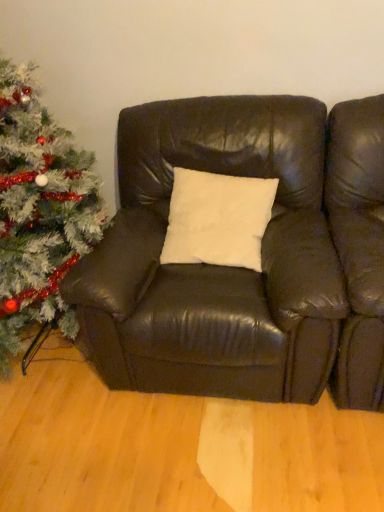
Question: Is point (182, 382) positioned closer to the camera than point (54, 321)?

Choices:
 (A) farther
 (B) closer

Answer: (B)

Question: Considering their positions, is matte brown leather couch at center located in front of or behind white glittery christmas tree at left?

Choices:
 (A) front
 (B) behind

Answer: (B)

Question: In the image, is matte brown leather couch at center on the left side or the right side of white glittery christmas tree at left?

Choices:
 (A) left
 (B) right

Answer: (B)

Question: Does point (8, 308) appear closer or farther from the camera than point (221, 126)?

Choices:
 (A) farther
 (B) closer

Answer: (B)

Question: From a real-world perspective, is white glittery christmas tree at left above or below matte brown leather couch at center?

Choices:
 (A) above
 (B) below

Answer: (A)

Question: Considering the positions of white glittery christmas tree at left and matte brown leather couch at center in the image, is white glittery christmas tree at left taller or shorter than matte brown leather couch at center?

Choices:
 (A) tall
 (B) short

Answer: (A)

Question: Would you say white glittery christmas tree at left is to the left or to the right of matte brown leather couch at center in the picture?

Choices:
 (A) right
 (B) left

Answer: (B)